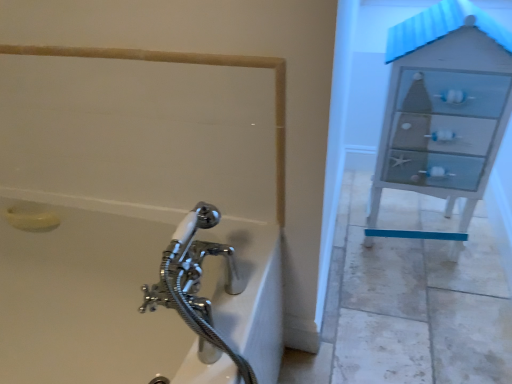
Question: Can you confirm if white glossy file cabinet at right is positioned to the right of white glossy bathtub at lower left?

Choices:
 (A) no
 (B) yes

Answer: (B)

Question: From the image's perspective, is white glossy file cabinet at right below white glossy bathtub at lower left?

Choices:
 (A) no
 (B) yes

Answer: (A)

Question: Could you tell me if white glossy file cabinet at right is facing white glossy bathtub at lower left?

Choices:
 (A) yes
 (B) no

Answer: (B)

Question: From the image's perspective, would you say white glossy file cabinet at right is positioned over white glossy bathtub at lower left?

Choices:
 (A) yes
 (B) no

Answer: (A)

Question: Would you say white glossy file cabinet at right is a long distance from white glossy bathtub at lower left?

Choices:
 (A) no
 (B) yes

Answer: (A)

Question: From a real-world perspective, is white glossy file cabinet at right located beneath white glossy bathtub at lower left?

Choices:
 (A) yes
 (B) no

Answer: (B)

Question: Is white glossy bathtub at lower left behind white glossy file cabinet at right?

Choices:
 (A) no
 (B) yes

Answer: (A)

Question: Does white glossy bathtub at lower left touch white glossy file cabinet at right?

Choices:
 (A) no
 (B) yes

Answer: (A)

Question: From a real-world perspective, is white glossy bathtub at lower left located beneath white glossy file cabinet at right?

Choices:
 (A) yes
 (B) no

Answer: (A)

Question: Is white glossy bathtub at lower left outside white glossy file cabinet at right?

Choices:
 (A) yes
 (B) no

Answer: (A)

Question: Is white glossy bathtub at lower left looking in the opposite direction of white glossy file cabinet at right?

Choices:
 (A) yes
 (B) no

Answer: (B)

Question: Is white glossy bathtub at lower left closer to the viewer compared to white glossy file cabinet at right?

Choices:
 (A) no
 (B) yes

Answer: (B)

Question: Would you consider yellow matte soap at lower left to be distant from white glossy bathtub at lower left?

Choices:
 (A) yes
 (B) no

Answer: (B)